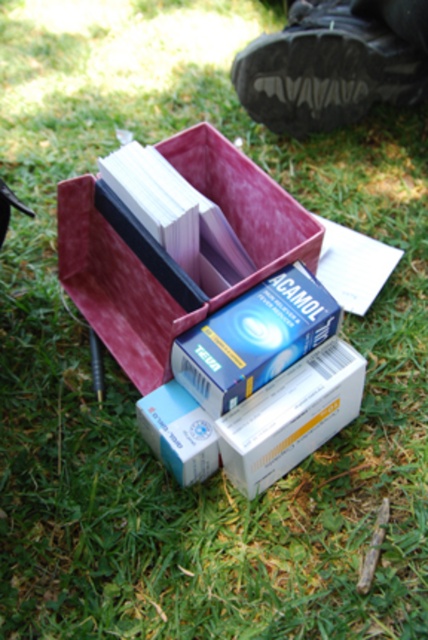
Does point (303, 380) come in front of point (190, 422)?

That is False.

Between point (262, 451) and point (139, 400), which one is positioned in front?

Point (262, 451) is more forward.

You are a GUI agent. You are given a task and a screenshot of the screen. Output one action in this format:
    pyautogui.click(x=<x>, y=<y>)
    Task: Click on the white cardboard box at center
    
    Given the screenshot: What is the action you would take?
    pyautogui.click(x=291, y=417)

Is point (88, 227) closer to viewer compared to point (168, 451)?

No, (88, 227) is behind (168, 451).

Who is positioned more to the left, velvet-like pink shoe box at center or blue cardboard box at center?

Positioned to the left is blue cardboard box at center.

Is point (258, 248) farther from viewer compared to point (163, 404)?

Yes, point (258, 248) is farther from viewer.

Where is `velvet-like pink shoe box at center`? The width and height of the screenshot is (428, 640). velvet-like pink shoe box at center is located at coordinates (146, 269).

Does velvet-like pink shoe box at center appear on the left side of white cardboard box at center?

Yes, velvet-like pink shoe box at center is to the left of white cardboard box at center.

Between velvet-like pink shoe box at center and white cardboard box at center, which one has more height?

velvet-like pink shoe box at center is taller.

Is point (104, 269) behind point (284, 396)?

That is True.

Locate an element on the screen. velvet-like pink shoe box at center is located at coordinates (146, 269).